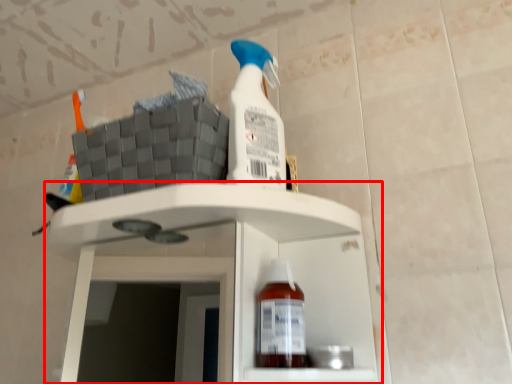
Question: Considering the relative positions of shelf (annotated by the red box) and bottle in the image provided, where is shelf (annotated by the red box) located with respect to the staircase?

Choices:
 (A) left
 (B) right

Answer: (A)